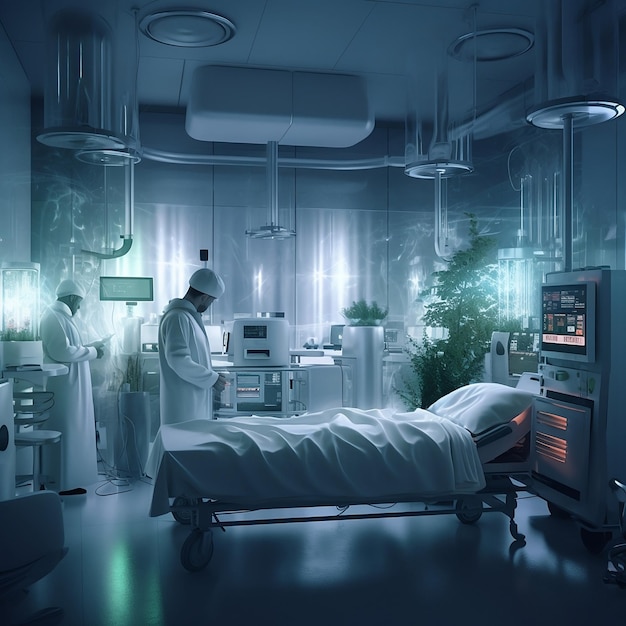
This screenshot has height=626, width=626. Identify the location of hospital room. (337, 233).